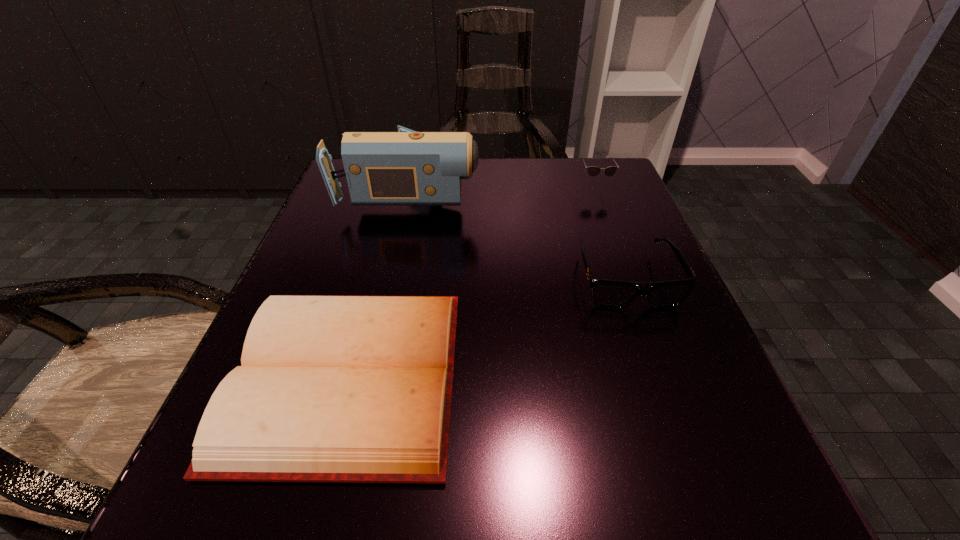
At what (x,y) coordinates should I click in order to perform the action: click on vacant area that lies between the Bible and the shorter sunglasses. Please return your answer as a coordinate pair (x, y). This screenshot has height=540, width=960. Looking at the image, I should click on (487, 328).

Where is `free spot between the Bible and the third shortest object`? The height and width of the screenshot is (540, 960). free spot between the Bible and the third shortest object is located at coordinates (470, 281).

This screenshot has width=960, height=540. I want to click on free spot between the shorter sunglasses and the tallest object, so pyautogui.click(x=518, y=235).

At what (x,y) coordinates should I click in order to perform the action: click on object that can be found as the third closest to the Bible. Please return your answer as a coordinate pair (x, y). Looking at the image, I should click on (593, 171).

Point out which object is positioned as the nearest to the nearer sunglasses. Please provide its 2D coordinates. Your answer should be formatted as a tuple, i.e. [(x, y)], where the tuple contains the x and y coordinates of a point satisfying the conditions above.

[(406, 167)]

Where is `vacant point that satisfies the following two spatial constraints: 1. in front of the lenses of the taller sunglasses; 2. on the side of the tallest object with the flip-out screen`? vacant point that satisfies the following two spatial constraints: 1. in front of the lenses of the taller sunglasses; 2. on the side of the tallest object with the flip-out screen is located at coordinates [x=596, y=191].

This screenshot has width=960, height=540. Identify the location of vacant region that satisfies the following two spatial constraints: 1. in front of the lenses of the taller sunglasses; 2. on the side of the tallest object with the flip-out screen. (596, 191).

You are a GUI agent. You are given a task and a screenshot of the screen. Output one action in this format:
    pyautogui.click(x=<x>, y=<y>)
    Task: Click on the vacant position in the image that satisfies the following two spatial constraints: 1. in front of the lenses of the farther sunglasses; 2. on the side of the tallest object with the flip-out screen
    The image size is (960, 540).
    Given the screenshot: What is the action you would take?
    pyautogui.click(x=596, y=191)